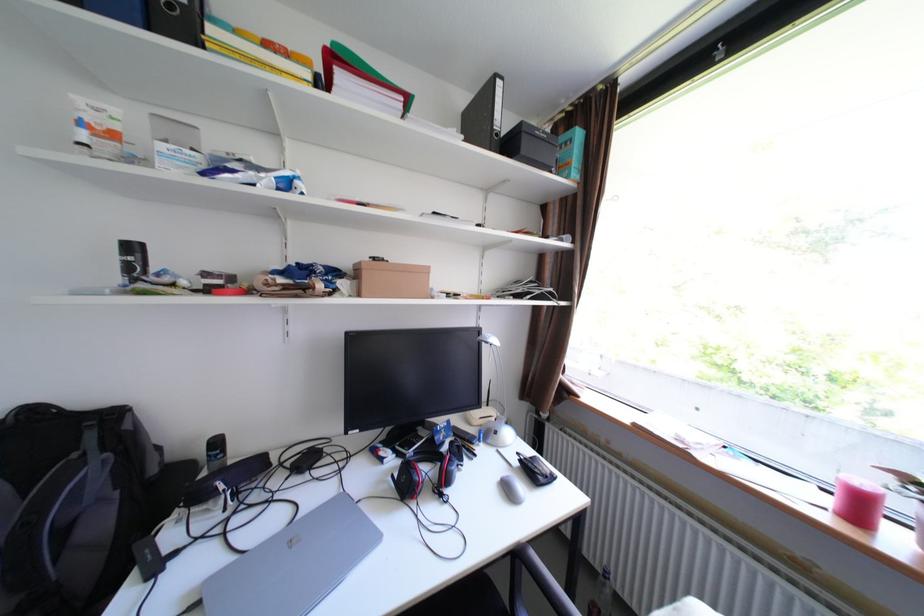
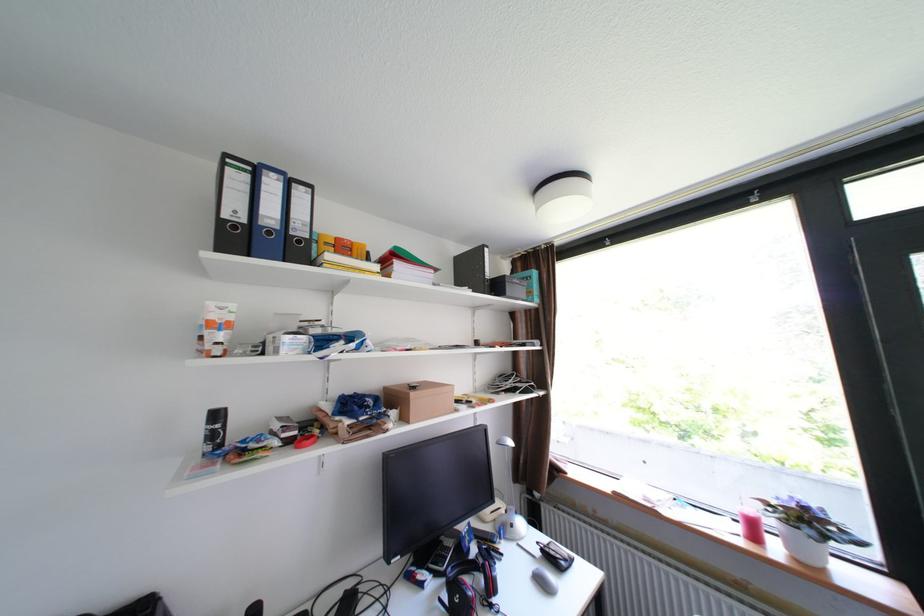
In the second image, find the point that corresponds to point 517,490 in the first image.

(552, 583)